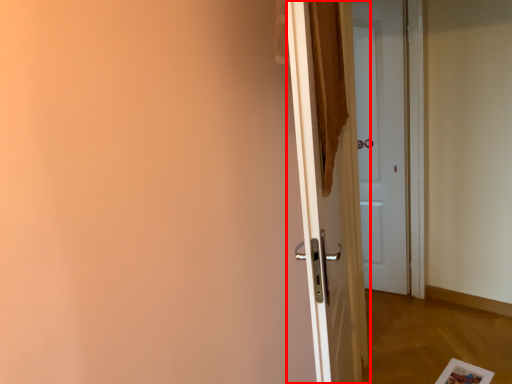
Question: From the image's perspective, considering the relative positions of door (annotated by the red box) and door in the image provided, where is door (annotated by the red box) located with respect to the staircase?

Choices:
 (A) above
 (B) below

Answer: (B)